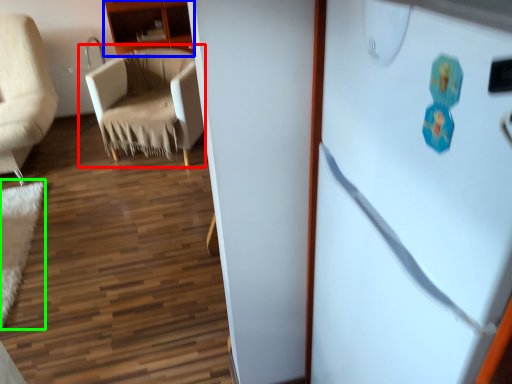
Question: Estimate the real-world distances between objects in this image. Which object is farther from chair (highlighted by a red box), cabinetry (highlighted by a blue box) or mat (highlighted by a green box)?

Choices:
 (A) cabinetry
 (B) mat

Answer: (B)